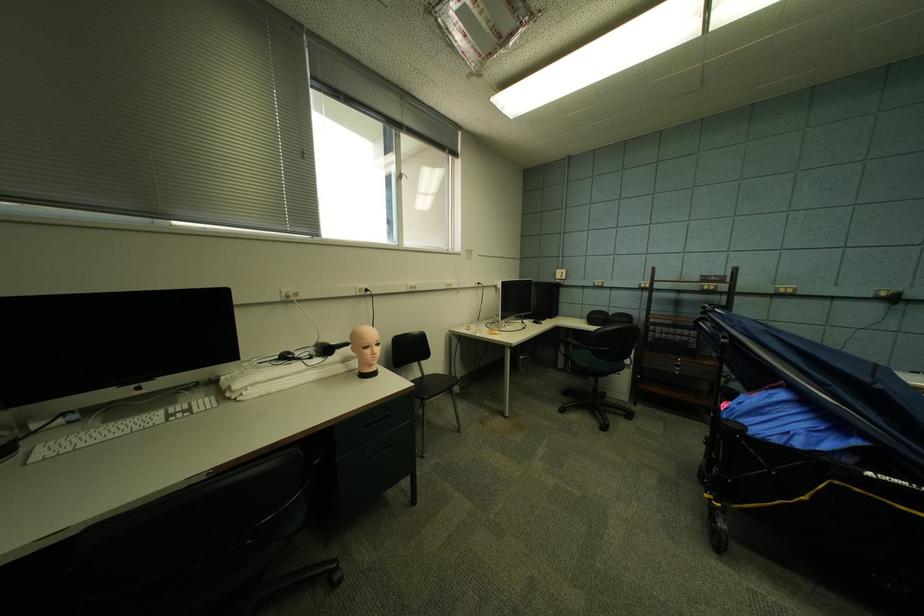
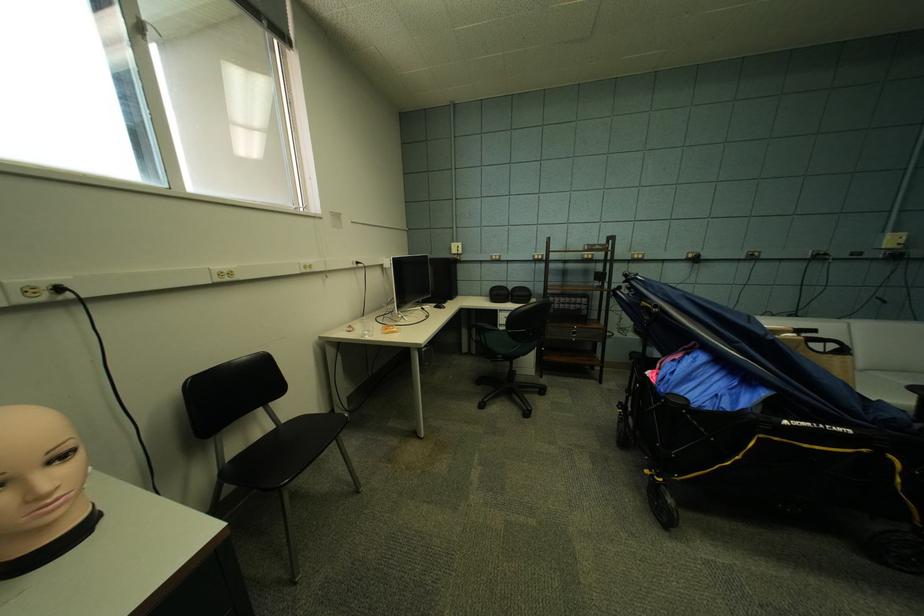
Question: Based on the continuous images, in which direction is the camera rotating? Reply with the corresponding letter.

Choices:
 (A) Left
 (B) Right
 (C) Up
 (D) Down

Answer: (B)